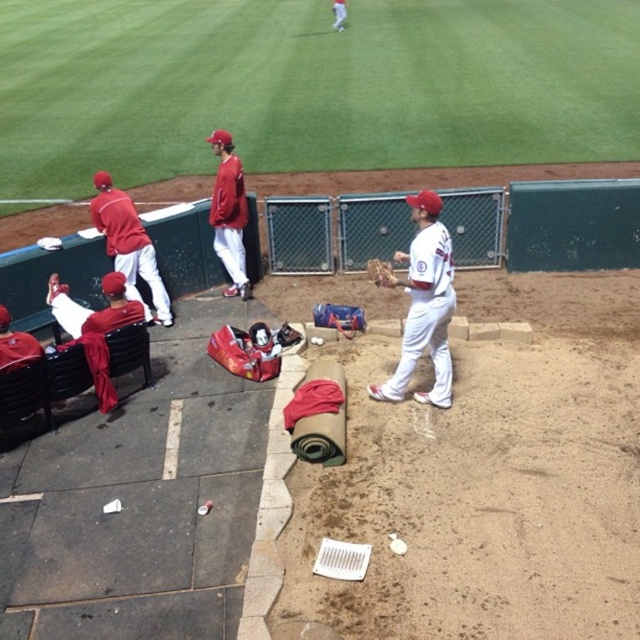
Is point (76, 84) positioned in front of point (243, 241)?

No, it is behind (243, 241).

Find the location of a particular element. green grass at upper center is located at coordinates (308, 84).

Consider the image. Is matte red baseball cap at left shorter than white matte uniform at upper center?

Yes.

What do you see at coordinates (16, 346) in the screenshot?
I see `matte red baseball cap at left` at bounding box center [16, 346].

I want to click on matte red baseball cap at left, so click(16, 346).

Based on the photo, is matte red uniform at left positioned in front of white matte uniform at upper center?

That is True.

Locate an element on the screen. This screenshot has height=640, width=640. matte red uniform at left is located at coordinates (129, 244).